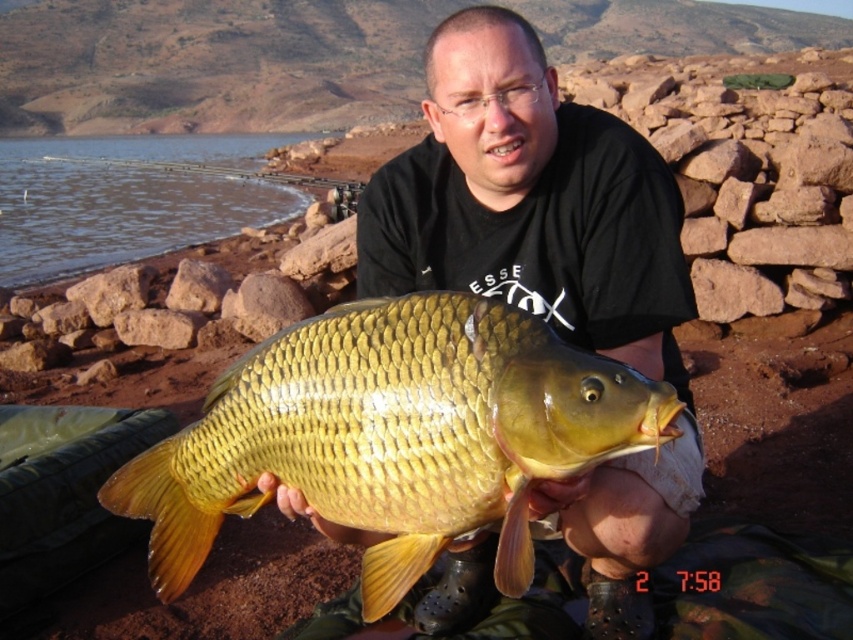
Question: Does matte gold fish at center appear over brown smooth water at upper left?

Choices:
 (A) no
 (B) yes

Answer: (A)

Question: Which point appears farthest from the camera in this image?

Choices:
 (A) (686, 305)
 (B) (140, 148)
 (C) (433, 397)

Answer: (B)

Question: Which of the following is the closest to the observer?

Choices:
 (A) (442, 76)
 (B) (106, 244)

Answer: (A)

Question: Can you confirm if shiny gold fish at center is positioned to the right of brown smooth water at upper left?

Choices:
 (A) yes
 (B) no

Answer: (A)

Question: Based on their relative distances, which object is farther from the shiny gold fish at center?

Choices:
 (A) matte gold fish at center
 (B) brown smooth water at upper left

Answer: (B)

Question: Can you confirm if matte gold fish at center is positioned to the left of shiny gold fish at center?

Choices:
 (A) no
 (B) yes

Answer: (A)